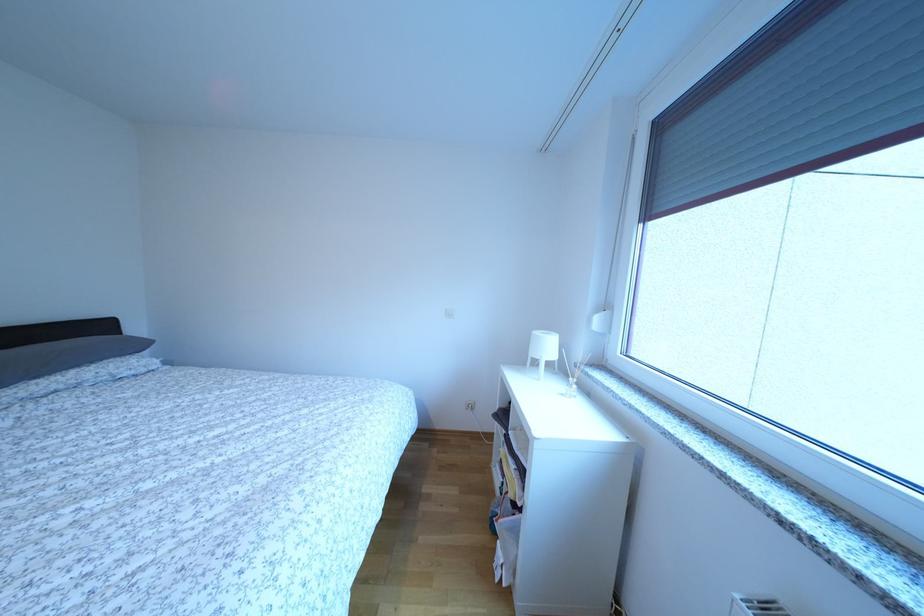
Which object does [448,313] point to?

It corresponds to the white light switch in the image.